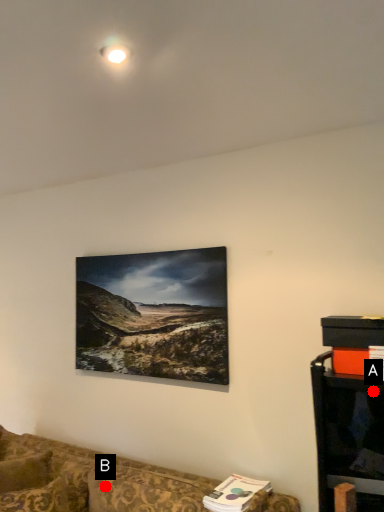
Question: Two points are circled on the image, labeled by A and B beside each circle. Which point is closer to the camera taking this photo?

Choices:
 (A) A is closer
 (B) B is closer

Answer: (A)